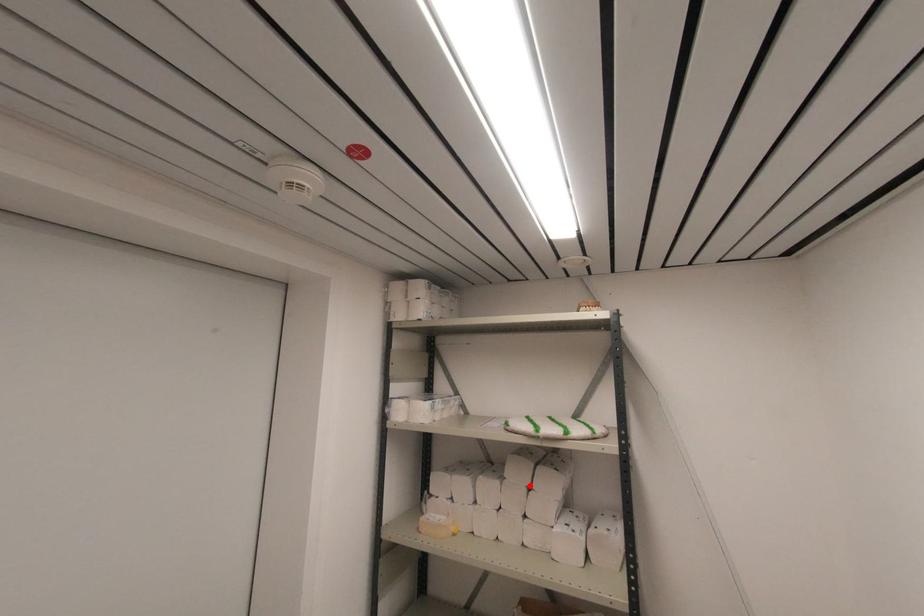
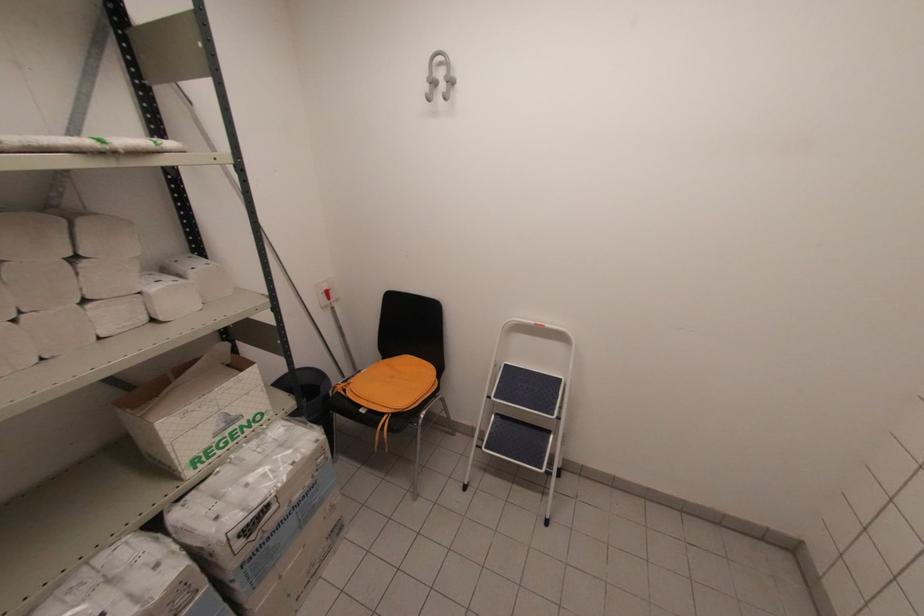
In the second image, find the point that corresponds to the highlighted location in the first image.

(71, 254)